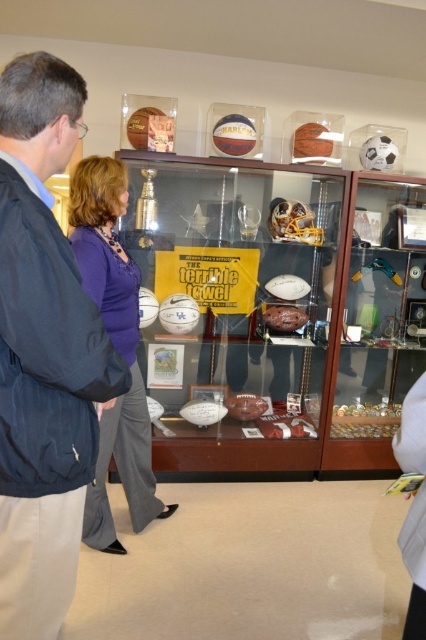
Between dark blue jacket at left and purple fabric blouse at center, which one appears on the left side from the viewer's perspective?

From the viewer's perspective, purple fabric blouse at center appears more on the left side.

Does dark blue jacket at left lie behind purple fabric blouse at center?

That is False.

At what (x,y) coordinates should I click in order to perform the action: click on dark blue jacket at left. Please return your answer as a coordinate pair (x, y). This screenshot has width=426, height=640. Looking at the image, I should click on (43, 353).

What are the coordinates of `dark blue jacket at left` in the screenshot? It's located at (43, 353).